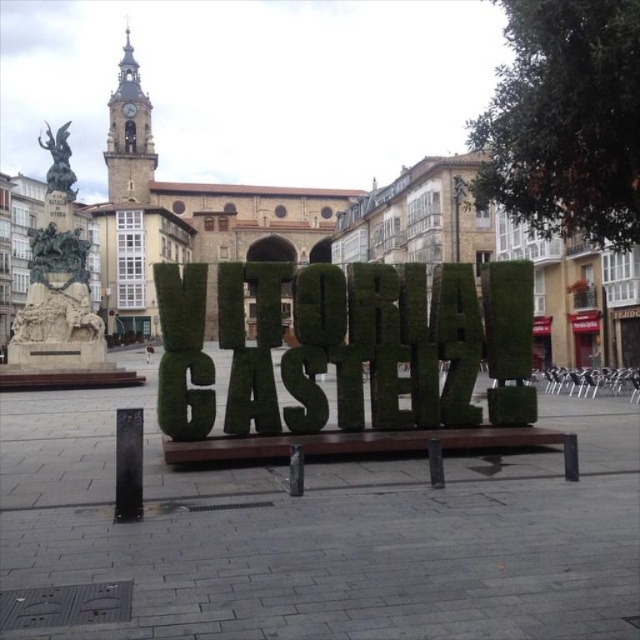
Question: Which object is farther from the camera taking this photo?

Choices:
 (A) green grass sign at center
 (B) green mossy letter at center

Answer: (B)

Question: Where is green mossy letter at center located in relation to green grass sign at center in the image?

Choices:
 (A) left
 (B) right

Answer: (A)

Question: Which point is farther to the camera?

Choices:
 (A) green mossy letter at center
 (B) green grass sign at center

Answer: (A)

Question: Can you confirm if green mossy letter at center is thinner than green grass sign at center?

Choices:
 (A) yes
 (B) no

Answer: (A)

Question: Is green mossy letter at center thinner than green grass sign at center?

Choices:
 (A) yes
 (B) no

Answer: (A)